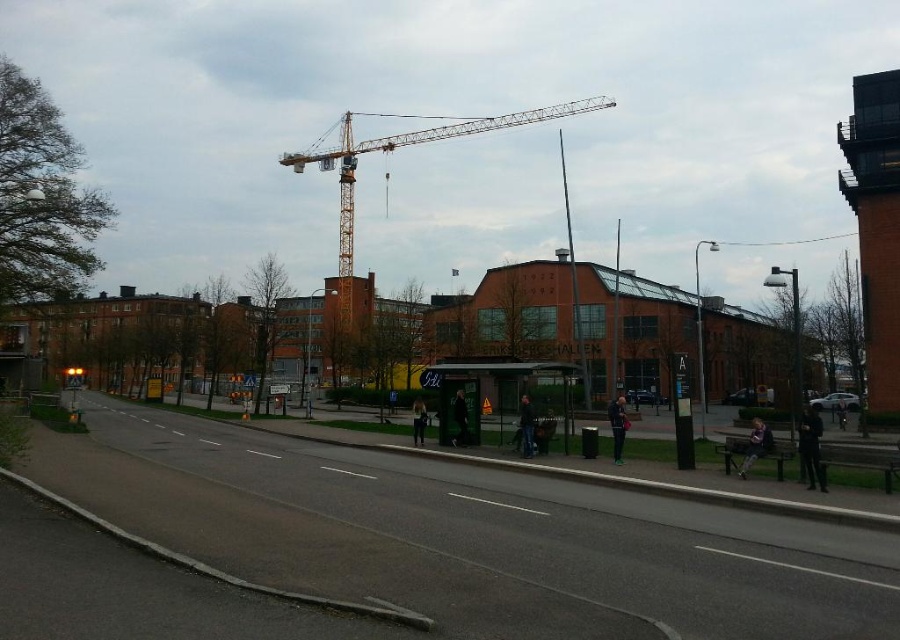
Who is higher up, yellow metallic crane at upper center or dark blue denim jacket at lower right?

yellow metallic crane at upper center

Does yellow metallic crane at upper center lie behind dark blue denim jacket at lower right?

That is True.

Who is more forward, [312,161] or [757,445]?

Point [757,445] is in front.

Find the location of `yellow metallic crane at upper center`. yellow metallic crane at upper center is located at coordinates (402, 147).

Between transparent plastic bus stop at center and dark blue jacket at center, which one has less height?

Standing shorter between the two is transparent plastic bus stop at center.

Based on the photo, measure the distance between point (518, 390) and camera.

They are 83.19 feet apart.

Locate an element on the screen. This screenshot has height=640, width=900. transparent plastic bus stop at center is located at coordinates (500, 392).

Is transparent plastic bus stop at center smaller than dark blue jeans at center?

No, transparent plastic bus stop at center is not smaller than dark blue jeans at center.

Between transparent plastic bus stop at center and dark blue jeans at center, which one appears on the right side from the viewer's perspective?

Positioned to the right is transparent plastic bus stop at center.

At what (x,y) coordinates should I click in order to perform the action: click on transparent plastic bus stop at center. Please return your answer as a coordinate pair (x, y). The height and width of the screenshot is (640, 900). Looking at the image, I should click on (500, 392).